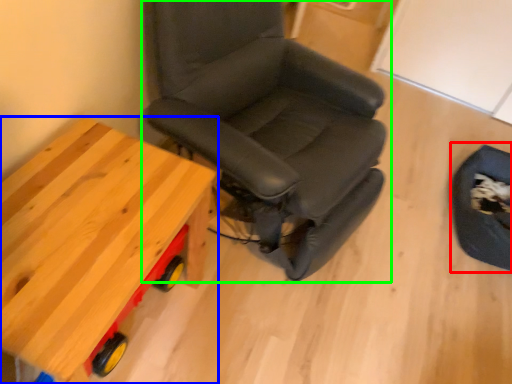
Question: Considering the real-world distances, which object is closest to swivel chair (highlighted by a red box)? table (highlighted by a blue box) or chair (highlighted by a green box).

Choices:
 (A) table
 (B) chair

Answer: (B)